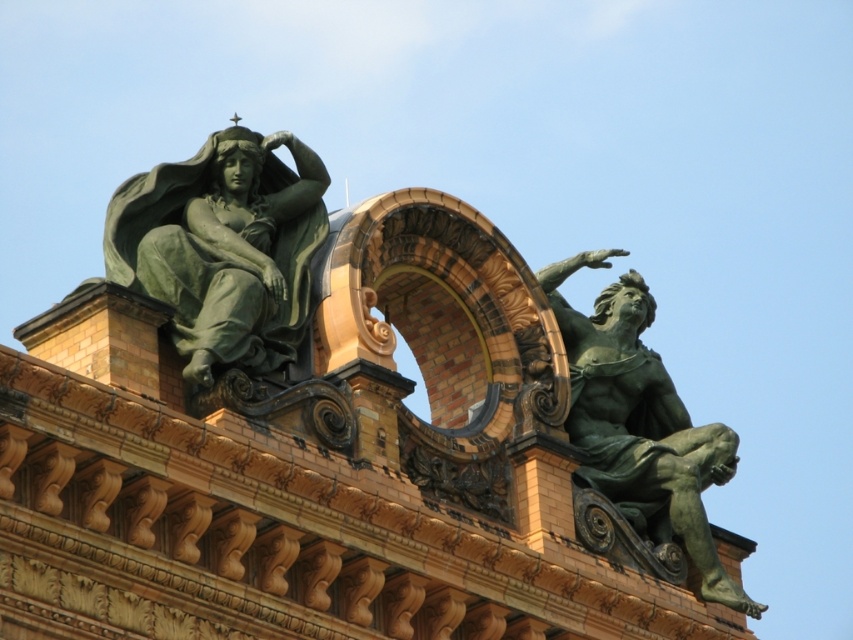
Who is shorter, green patina statue at upper left or green patina statue at right?

green patina statue at upper left

Between green patina statue at upper left and green patina statue at right, which one appears on the right side from the viewer's perspective?

green patina statue at right

This screenshot has width=853, height=640. What do you see at coordinates (223, 248) in the screenshot? I see `green patina statue at upper left` at bounding box center [223, 248].

The image size is (853, 640). I want to click on green patina statue at upper left, so click(x=223, y=248).